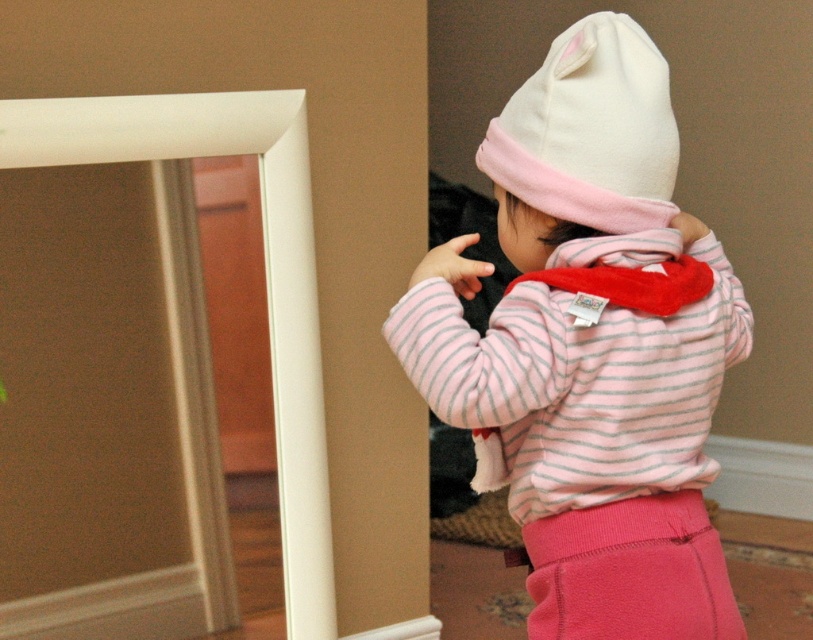
Question: Considering the relative positions of pink fleece hat at upper right and pink fleece pants at lower right in the image provided, where is pink fleece hat at upper right located with respect to pink fleece pants at lower right?

Choices:
 (A) right
 (B) left

Answer: (B)

Question: Which object appears closest to the camera in this image?

Choices:
 (A) pink fleece pants at lower right
 (B) pink fleece hat at upper right
 (C) white fleece hat at upper right

Answer: (C)

Question: Which point is closer to the camera?

Choices:
 (A) pink fleece pants at lower right
 (B) pink fleece hat at upper right
 (C) white fleece hat at upper right

Answer: (C)

Question: Is pink fleece hat at upper right further to the viewer compared to pink fleece pants at lower right?

Choices:
 (A) yes
 (B) no

Answer: (B)

Question: Which object appears closest to the camera in this image?

Choices:
 (A) white fleece hat at upper right
 (B) pink fleece hat at upper right
 (C) pink fleece pants at lower right

Answer: (A)

Question: Can you confirm if white fleece hat at upper right is positioned below pink fleece pants at lower right?

Choices:
 (A) no
 (B) yes

Answer: (A)